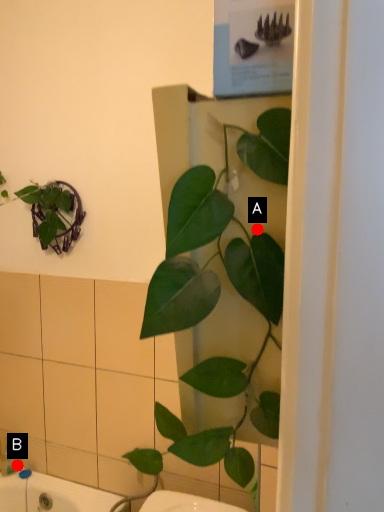
Question: Two points are circled on the image, labeled by A and B beside each circle. Which point is farther from the camera taking this photo?

Choices:
 (A) A is further
 (B) B is further

Answer: (B)